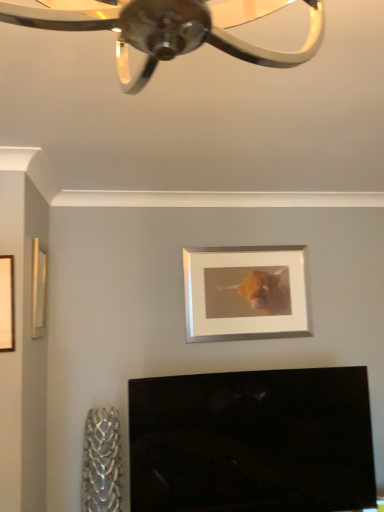
Question: Is wooden frame at left, the 2th picture frame positioned from the front, spatially inside white matte picture frame at upper center, the first picture frame from the right, or outside of it?

Choices:
 (A) outside
 (B) inside

Answer: (A)

Question: Is wooden frame at left, acting as the 2th picture frame starting from the left, bigger or smaller than white matte picture frame at upper center, which is the 1th picture frame from back to front?

Choices:
 (A) big
 (B) small

Answer: (B)

Question: Based on their relative distances, which object is farther from the white matte picture frame at upper center, placed as the 3th picture frame when sorted from left to right?

Choices:
 (A) wooden frame at left, the 2th picture frame positioned from the front
 (B) wooden frame at left, which is counted as the 1th picture frame, starting from the left

Answer: (B)

Question: Considering the real-world distances, which object is farthest from the white matte picture frame at upper center, which is the 1th picture frame from back to front?

Choices:
 (A) wooden frame at left, arranged as the 3th picture frame when viewed from the right
 (B) wooden frame at left, acting as the 2th picture frame starting from the left

Answer: (A)